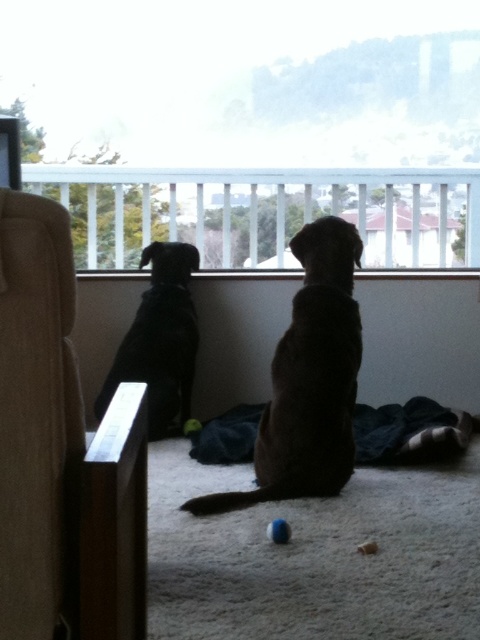
Question: Does brown furry dog at center lie behind black matte dog at left?

Choices:
 (A) no
 (B) yes

Answer: (A)

Question: Which of the following is the closest to the observer?

Choices:
 (A) (417, 244)
 (B) (344, 234)
 (C) (48, 259)

Answer: (C)

Question: Which of the following is the farthest from the observer?

Choices:
 (A) black matte dog at left
 (B) rubber ball at center

Answer: (B)

Question: Is beige fabric armchair at left positioned before blue rubber ball at center?

Choices:
 (A) no
 (B) yes

Answer: (B)

Question: Can you confirm if brown furry dog at center is thinner than rubber ball at center?

Choices:
 (A) no
 (B) yes

Answer: (A)

Question: Which object appears farthest from the camera in this image?

Choices:
 (A) white wooden rail at upper center
 (B) transparent glass window at upper center

Answer: (A)